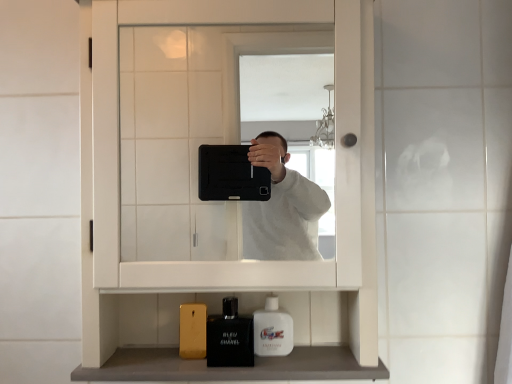
Image resolution: width=512 pixels, height=384 pixels. Find the location of `free spot to the right of matte black perfume at lower center`. free spot to the right of matte black perfume at lower center is located at coordinates [310, 357].